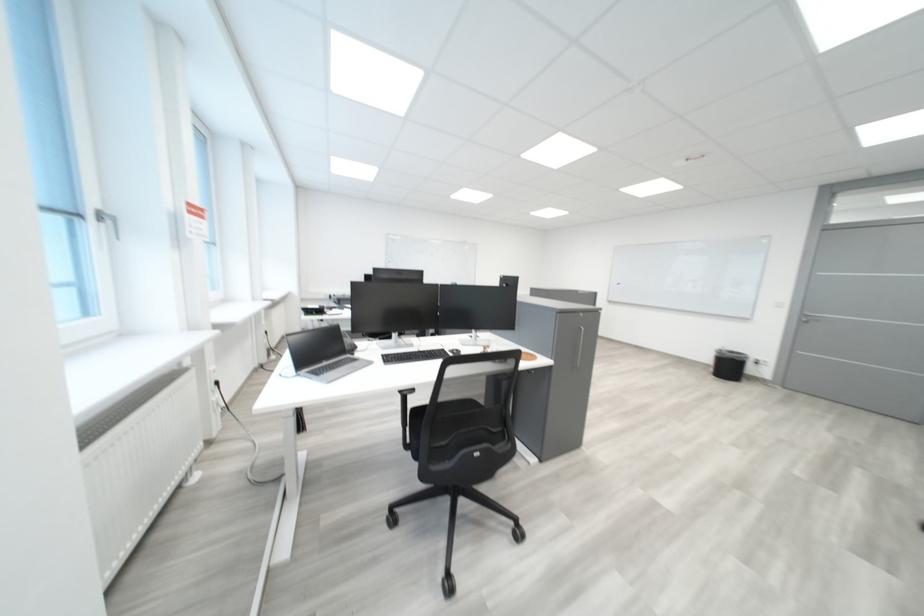
The location [728,363] corresponds to which object?

This point indicates the black trash can.